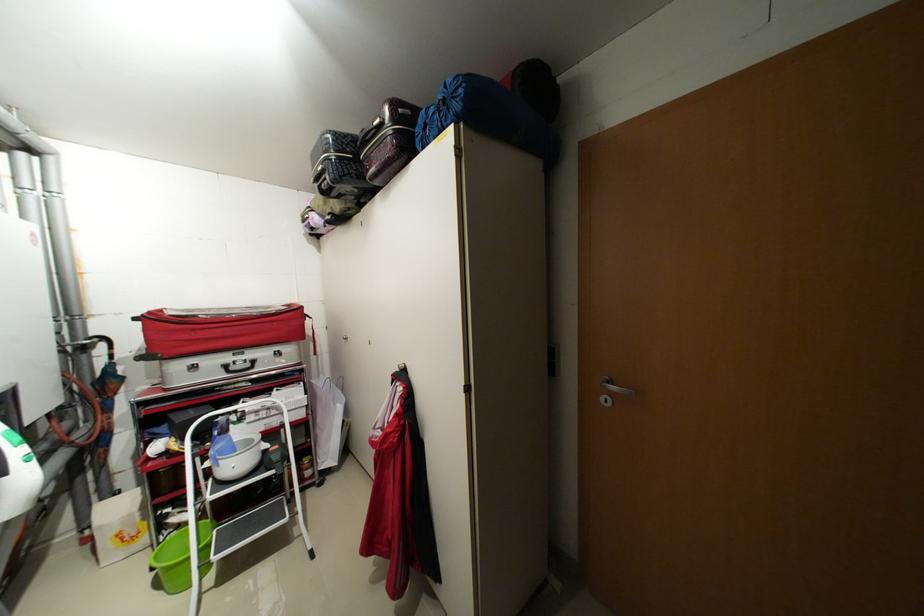
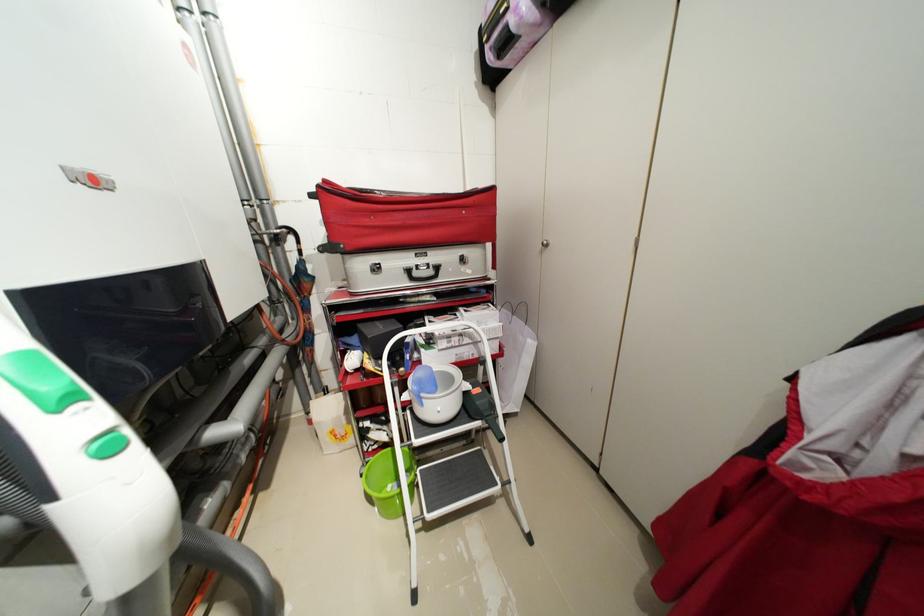
The images are taken continuously from a first-person perspective. In which direction are you moving?

The cameraman moved toward left, forward.